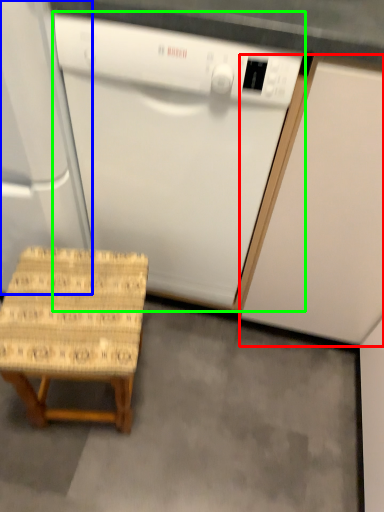
Question: Based on their relative distances, which object is nearer to cabinetry (highlighted by a red box)? Choose from appliance (highlighted by a blue box) and home appliance (highlighted by a green box).

Choices:
 (A) appliance
 (B) home appliance

Answer: (B)